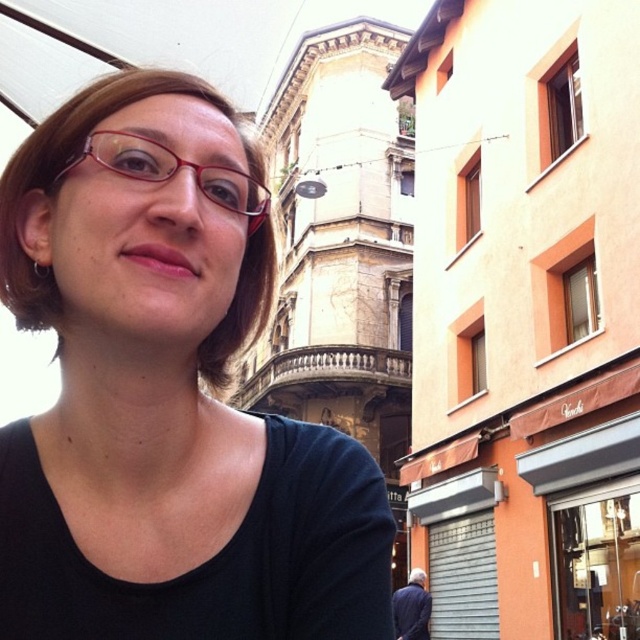
Is matte black shirt at center wider than matte red glasses at center?

Yes, matte black shirt at center is wider than matte red glasses at center.

Based on the photo, between matte black shirt at center and matte red glasses at center, which one has more height?

matte black shirt at center is taller.

Does point (307, 492) come closer to viewer compared to point (256, 228)?

Yes.

This screenshot has width=640, height=640. What are the coordinates of `matte black shirt at center` in the screenshot? It's located at (166, 394).

Is point (170, 280) positioned in front of point (412, 600)?

Yes.

Can you confirm if matte black shirt at center is shorter than dark blue fabric at lower right?

Indeed, matte black shirt at center has a lesser height compared to dark blue fabric at lower right.

You are a GUI agent. You are given a task and a screenshot of the screen. Output one action in this format:
    pyautogui.click(x=<x>, y=<y>)
    Task: Click on the matte black shirt at center
    
    Given the screenshot: What is the action you would take?
    pyautogui.click(x=166, y=394)

Between matte red glasses at center and dark blue fabric at lower right, which one has more height?

dark blue fabric at lower right

Is matte red glasses at center taller than dark blue fabric at lower right?

Incorrect, matte red glasses at center's height is not larger of dark blue fabric at lower right's.

Between point (248, 234) and point (406, 616), which one is positioned in front?

Point (248, 234) is more forward.

This screenshot has height=640, width=640. Find the location of `matte red glasses at center`. matte red glasses at center is located at coordinates (173, 172).